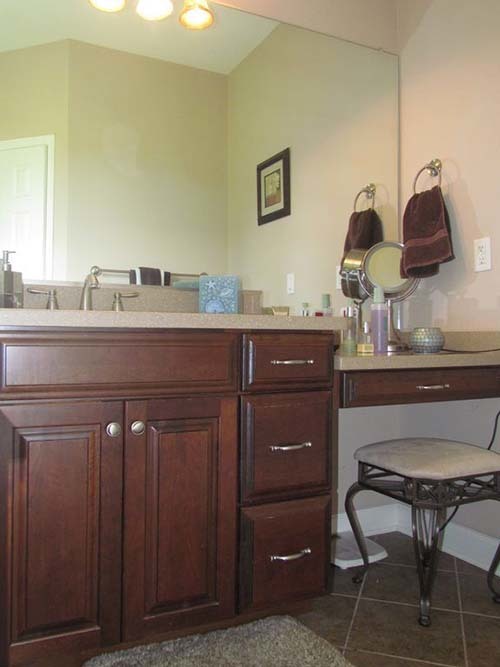
Locate an element on the screen. Image resolution: width=500 pixels, height=667 pixels. chair is located at coordinates click(431, 455).